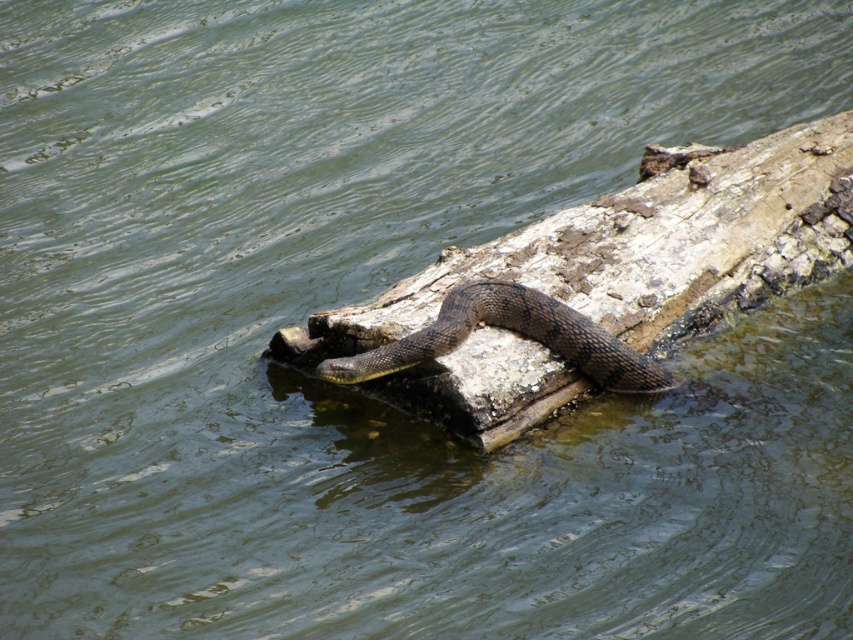
Does brown rough wood log at center have a greater width compared to brown scaly snake at center?

Yes.

Which is in front, point (543, 369) or point (531, 332)?

Point (543, 369) is in front.

Is point (701, 252) closer to camera compared to point (621, 349)?

No, it is not.

Locate an element on the screen. brown rough wood log at center is located at coordinates (645, 248).